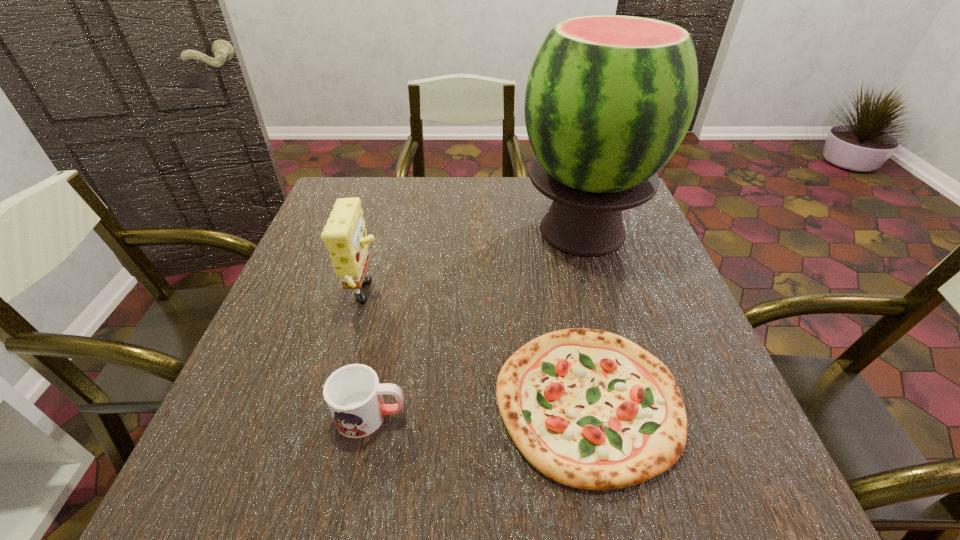
Locate an element on the screen. The width and height of the screenshot is (960, 540). object that stands as the third closest to the shortest object is located at coordinates (344, 235).

Select which object is the closest to the sponge. Please provide its 2D coordinates. Your answer should be formatted as a tuple, i.e. [(x, y)], where the tuple contains the x and y coordinates of a point satisfying the conditions above.

[(354, 396)]

The width and height of the screenshot is (960, 540). Identify the location of blank area in the image that satisfies the following two spatial constraints: 1. on the face of the shortest object; 2. on the right side of the third shortest object. (337, 401).

Find the location of a particular element. This screenshot has height=540, width=960. vacant space that satisfies the following two spatial constraints: 1. on the front side of the watermelon; 2. on the face of the third shortest object is located at coordinates [602, 298].

The height and width of the screenshot is (540, 960). Find the location of `vacant space that satisfies the following two spatial constraints: 1. on the front side of the tallest object; 2. on the side of the mug with the handle`. vacant space that satisfies the following two spatial constraints: 1. on the front side of the tallest object; 2. on the side of the mug with the handle is located at coordinates (636, 415).

I want to click on free space that satisfies the following two spatial constraints: 1. on the face of the sponge; 2. on the right side of the shortest object, so click(x=337, y=401).